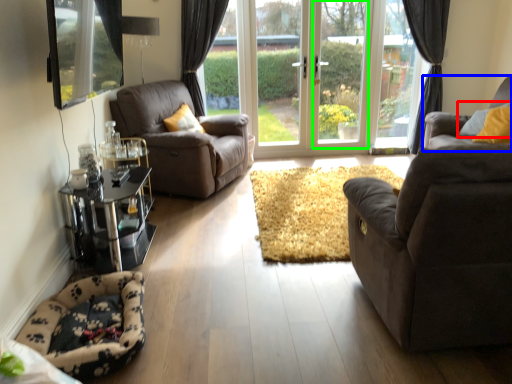
Question: Estimate the real-world distances between objects in this image. Which object is closer to pillow (highlighted by a red box), studio couch (highlighted by a blue box) or window frame (highlighted by a green box)?

Choices:
 (A) studio couch
 (B) window frame

Answer: (A)